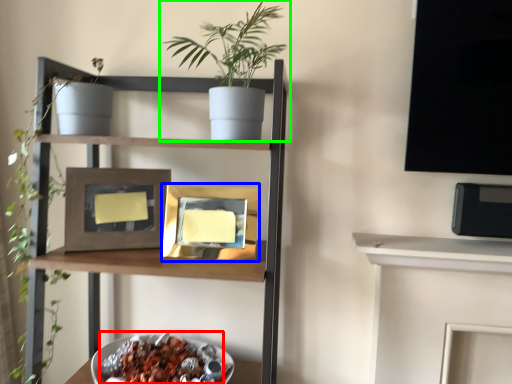
Question: Based on their relative distances, which object is farther from food (highlighted by a red box)? Choose from picture frame (highlighted by a blue box) and houseplant (highlighted by a green box).

Choices:
 (A) picture frame
 (B) houseplant

Answer: (B)